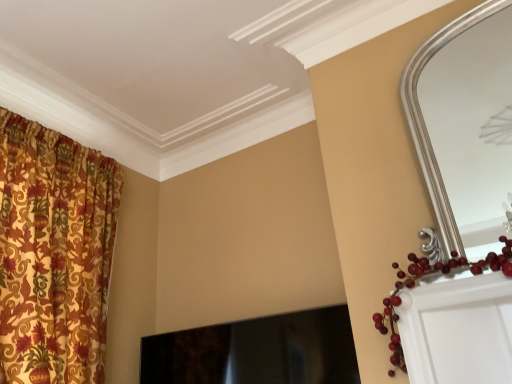
Question: Is silver metallic mirror at upper right closer to the viewer compared to black glossy fireplace at center?

Choices:
 (A) no
 (B) yes

Answer: (B)

Question: Can you confirm if silver metallic mirror at upper right is positioned to the left of black glossy fireplace at center?

Choices:
 (A) no
 (B) yes

Answer: (A)

Question: Does silver metallic mirror at upper right turn towards black glossy fireplace at center?

Choices:
 (A) yes
 (B) no

Answer: (B)

Question: From a real-world perspective, is silver metallic mirror at upper right positioned over black glossy fireplace at center based on gravity?

Choices:
 (A) yes
 (B) no

Answer: (A)

Question: Is silver metallic mirror at upper right thinner than black glossy fireplace at center?

Choices:
 (A) yes
 (B) no

Answer: (A)

Question: From the image's perspective, is silver metallic mirror at upper right beneath black glossy fireplace at center?

Choices:
 (A) no
 (B) yes

Answer: (A)

Question: Is black glossy fireplace at center wider than silver metallic mirror at upper right?

Choices:
 (A) no
 (B) yes

Answer: (B)

Question: From the image's perspective, is black glossy fireplace at center over silver metallic mirror at upper right?

Choices:
 (A) yes
 (B) no

Answer: (B)

Question: From the image's perspective, is black glossy fireplace at center beneath silver metallic mirror at upper right?

Choices:
 (A) yes
 (B) no

Answer: (A)

Question: Is black glossy fireplace at center further to the viewer compared to silver metallic mirror at upper right?

Choices:
 (A) no
 (B) yes

Answer: (B)

Question: Is black glossy fireplace at center taller than silver metallic mirror at upper right?

Choices:
 (A) yes
 (B) no

Answer: (B)

Question: Does black glossy fireplace at center appear on the left side of silver metallic mirror at upper right?

Choices:
 (A) yes
 (B) no

Answer: (A)

Question: From the image's perspective, is silver metallic mirror at upper right above or below black glossy fireplace at center?

Choices:
 (A) below
 (B) above

Answer: (B)